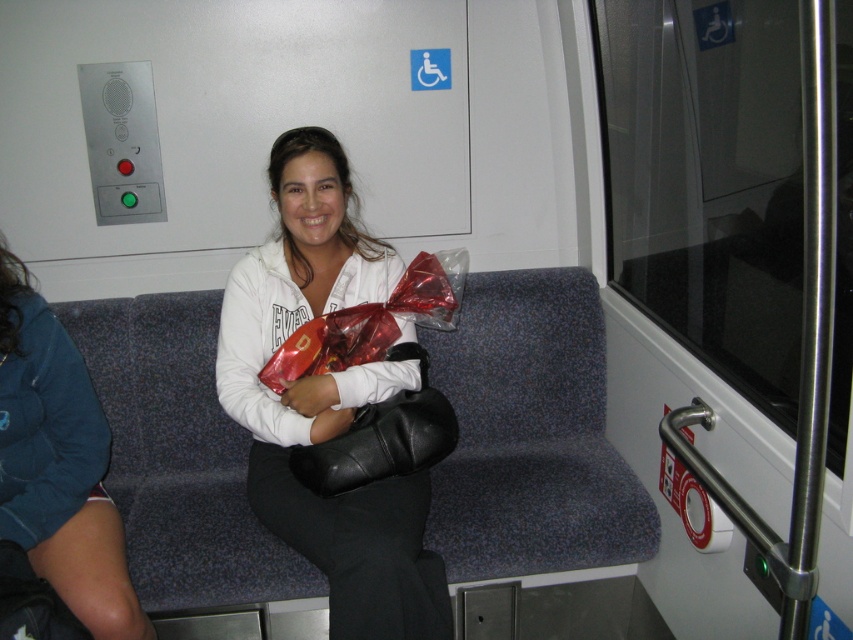
Question: Is black leather bag at center above glossy leather bag at center?

Choices:
 (A) yes
 (B) no

Answer: (B)

Question: Can you confirm if white matte jacket at center is smaller than black leather bag at center?

Choices:
 (A) no
 (B) yes

Answer: (A)

Question: Estimate the real-world distances between objects in this image. Which object is closer to the matte white hoodie at center?

Choices:
 (A) white matte jacket at center
 (B) black leather bag at center

Answer: (A)

Question: Considering the real-world distances, which object is farthest from the matte white hoodie at center?

Choices:
 (A) white matte jacket at center
 (B) black leather bag at center
 (C) glossy leather bag at center

Answer: (C)

Question: Does white matte jacket at center appear over black leather bag at center?

Choices:
 (A) no
 (B) yes

Answer: (B)

Question: Which point is closer to the camera?

Choices:
 (A) (234, 378)
 (B) (67, 582)
 (C) (386, 320)
 (D) (347, 464)

Answer: (B)